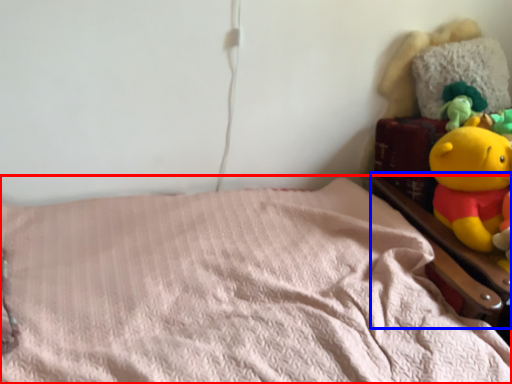
Question: Which object appears farthest to the camera in this image, bed (highlighted by a red box) or bed frame (highlighted by a blue box)?

Choices:
 (A) bed
 (B) bed frame

Answer: (B)